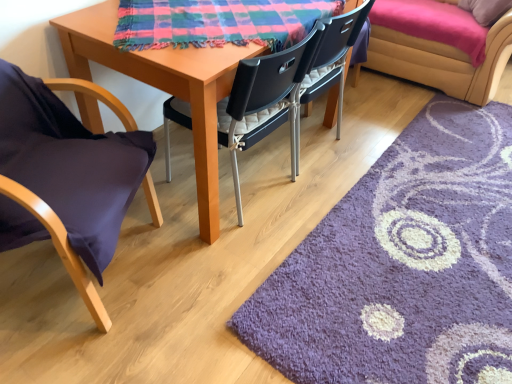
Question: Considering their positions, is purple shaggy rug at lower right located in front of or behind velvet yellow couch at upper right?

Choices:
 (A) front
 (B) behind

Answer: (A)

Question: Considering the positions of purple shaggy rug at lower right and velvet yellow couch at upper right in the image, is purple shaggy rug at lower right wider or thinner than velvet yellow couch at upper right?

Choices:
 (A) thin
 (B) wide

Answer: (B)

Question: Which of these objects is positioned farthest from the purple fabric chair at left, marked as the first chair in a left-to-right arrangement?

Choices:
 (A) black plastic chair at center, acting as the first chair starting from the right
 (B) plaid fabric at center
 (C) velvet yellow couch at upper right
 (D) purple shaggy rug at lower right

Answer: (C)

Question: Which object is positioned closest to the purple shaggy rug at lower right?

Choices:
 (A) black plastic chair at center, acting as the first chair starting from the right
 (B) purple fabric chair at left, marked as the first chair in a left-to-right arrangement
 (C) velvet yellow couch at upper right
 (D) plaid fabric at center

Answer: (A)